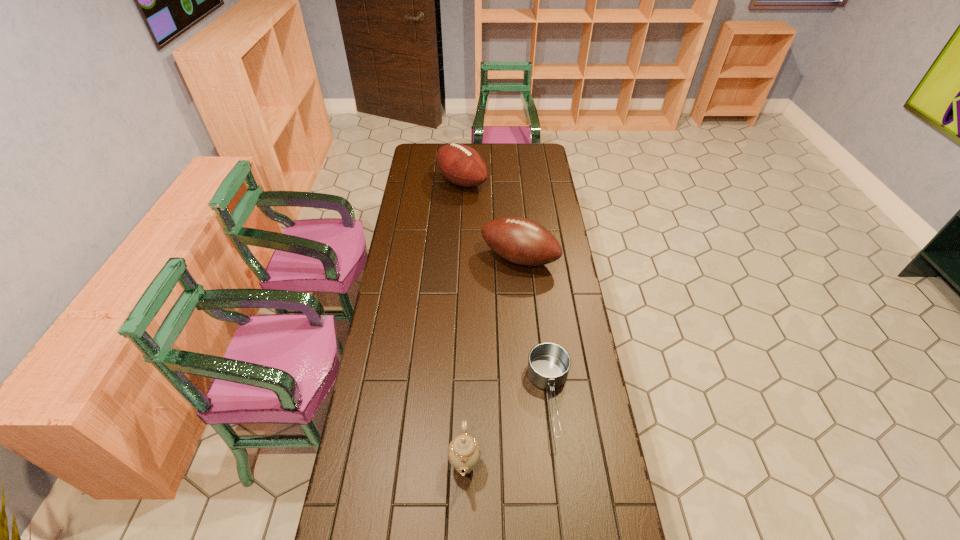
This screenshot has height=540, width=960. In order to click on vacant area that satisfies the following two spatial constraints: 1. with the handle extending from one side of the shortest object; 2. on the spout of the second shortest object in this screenshot , I will do `click(558, 464)`.

Image resolution: width=960 pixels, height=540 pixels. What are the coordinates of `vacant space that satisfies the following two spatial constraints: 1. with the handle extending from one side of the shortest object; 2. on the spout of the second shortest object` in the screenshot? It's located at (558, 464).

At what (x,y) coordinates should I click in order to perform the action: click on free point that satisfies the following two spatial constraints: 1. on the front side of the second farthest object; 2. on the spout of the second shortest object. Please return your answer as a coordinate pair (x, y). Looking at the image, I should click on coord(538,464).